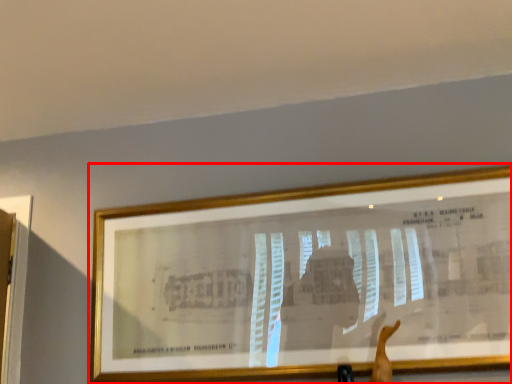
Question: From the image, what is the correct spatial relationship of picture frame (annotated by the red box) in relation to arm?

Choices:
 (A) left
 (B) right

Answer: (A)